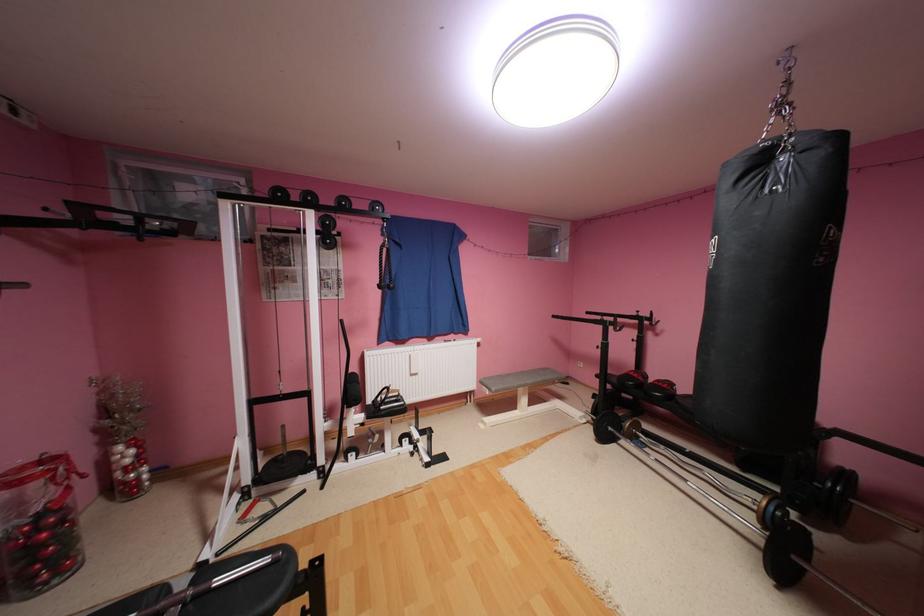
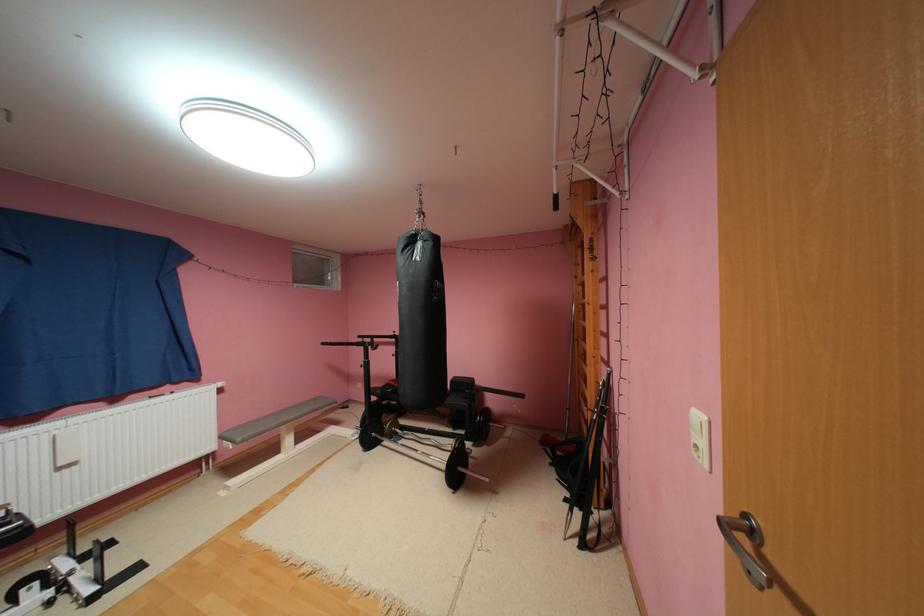
Where in the second image is the point corresponding to [643,314] from the first image?

(400, 334)